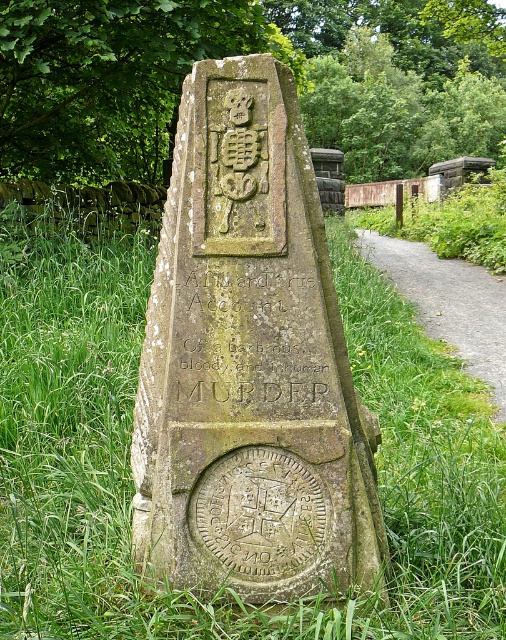
Does point (11, 531) lie behind point (304, 378)?

That is True.

Does point (468, 444) lie in front of point (256, 273)?

No, it is not.

What are the coordinates of `green mossy stone at center` in the screenshot? It's located at (132, 480).

Is green stone carving at upper center shorter than gravel path at right?

No, green stone carving at upper center is not shorter than gravel path at right.

Does green stone carving at upper center have a smaller size compared to gravel path at right?

Actually, green stone carving at upper center might be larger than gravel path at right.

Who is more distant from viewer, (2, 157) or (373, 232)?

Point (373, 232)

Image resolution: width=506 pixels, height=640 pixels. Find the location of `green stone carving at upper center`. green stone carving at upper center is located at coordinates (110, 80).

Does green mossy stone at center have a smaller size compared to green mossy stone monument at center?

No, green mossy stone at center is not smaller than green mossy stone monument at center.

Does point (110, 538) come closer to viewer compared to point (284, 470)?

That is False.

Where is `green mossy stone at center`? This screenshot has height=640, width=506. green mossy stone at center is located at coordinates (132, 480).